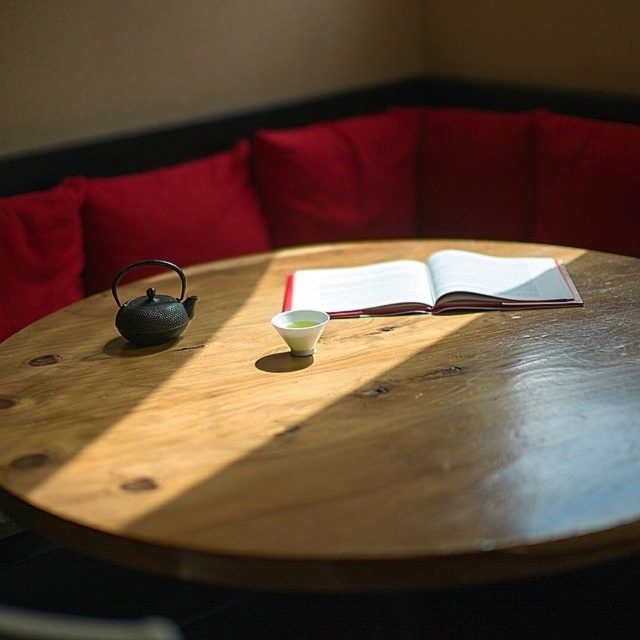
Does velvet red couch at upper center appear over white paper book at center?

Yes.

Which is in front, point (48, 161) or point (516, 284)?

Point (516, 284) is more forward.

The height and width of the screenshot is (640, 640). What are the coordinates of `velvet red couch at upper center` in the screenshot? It's located at (294, 125).

Can you confirm if velvet red pillow at upper left is positioned to the right of white paper book at center?

No, velvet red pillow at upper left is not to the right of white paper book at center.

The image size is (640, 640). Find the location of `velvet red pillow at upper left`. velvet red pillow at upper left is located at coordinates (170, 216).

Describe the element at coordinates (170, 216) in the screenshot. I see `velvet red pillow at upper left` at that location.

Image resolution: width=640 pixels, height=640 pixels. I want to click on velvet red pillow at upper left, so pyautogui.click(x=170, y=216).

Which of these two, velvet red couch at upper center or black textured teapot at left, stands shorter?

Standing shorter between the two is black textured teapot at left.

Between velvet red couch at upper center and black textured teapot at left, which one is positioned higher?

Positioned higher is velvet red couch at upper center.

Who is more distant from viewer, (364, 104) or (134, 308)?

The point (364, 104) is behind.

At what (x,y) coordinates should I click in order to perform the action: click on velvet red couch at upper center. Please return your answer as a coordinate pair (x, y). Looking at the image, I should click on (294, 125).